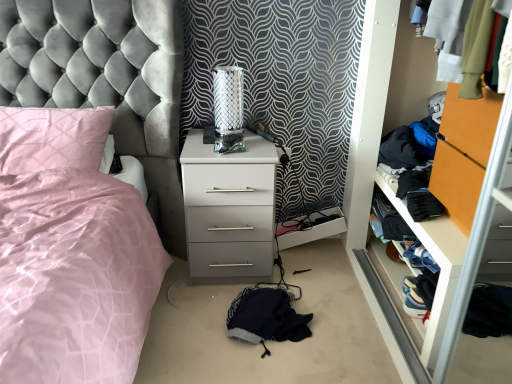
Question: From a real-world perspective, is denim jeans at lower right, marked as the second clothing in a bottom-to-top arrangement, located higher than satin pink bed at left?

Choices:
 (A) yes
 (B) no

Answer: (B)

Question: Does denim jeans at lower right, positioned as the third clothing in left-to-right order, have a lesser height compared to satin pink bed at left?

Choices:
 (A) yes
 (B) no

Answer: (A)

Question: Is denim jeans at lower right, marked as the second clothing in a bottom-to-top arrangement, smaller than satin pink bed at left?

Choices:
 (A) no
 (B) yes

Answer: (B)

Question: Does denim jeans at lower right, marked as the second clothing in a bottom-to-top arrangement, have a larger size compared to satin pink bed at left?

Choices:
 (A) no
 (B) yes

Answer: (A)

Question: Is denim jeans at lower right, marked as the first clothing in a right-to-left arrangement, positioned with its back to satin pink bed at left?

Choices:
 (A) yes
 (B) no

Answer: (B)

Question: Is satin pink bed at left a part of denim jeans at lower right, marked as the second clothing in a bottom-to-top arrangement?

Choices:
 (A) no
 (B) yes

Answer: (A)

Question: Is the surface of metallic mesh table lamp at center in direct contact with white glossy chest of drawers at center?

Choices:
 (A) no
 (B) yes

Answer: (A)

Question: From a real-world perspective, is metallic mesh table lamp at center physically above white glossy chest of drawers at center?

Choices:
 (A) no
 (B) yes

Answer: (B)

Question: Does metallic mesh table lamp at center have a larger size compared to white glossy chest of drawers at center?

Choices:
 (A) yes
 (B) no

Answer: (B)

Question: Can you confirm if metallic mesh table lamp at center is wider than white glossy chest of drawers at center?

Choices:
 (A) yes
 (B) no

Answer: (B)

Question: From a real-world perspective, is metallic mesh table lamp at center below white glossy chest of drawers at center?

Choices:
 (A) yes
 (B) no

Answer: (B)

Question: Can you confirm if metallic mesh table lamp at center is shorter than white glossy chest of drawers at center?

Choices:
 (A) no
 (B) yes

Answer: (B)

Question: From the image's perspective, is denim fabric clothes at right beneath satin pink bed at left?

Choices:
 (A) no
 (B) yes

Answer: (B)